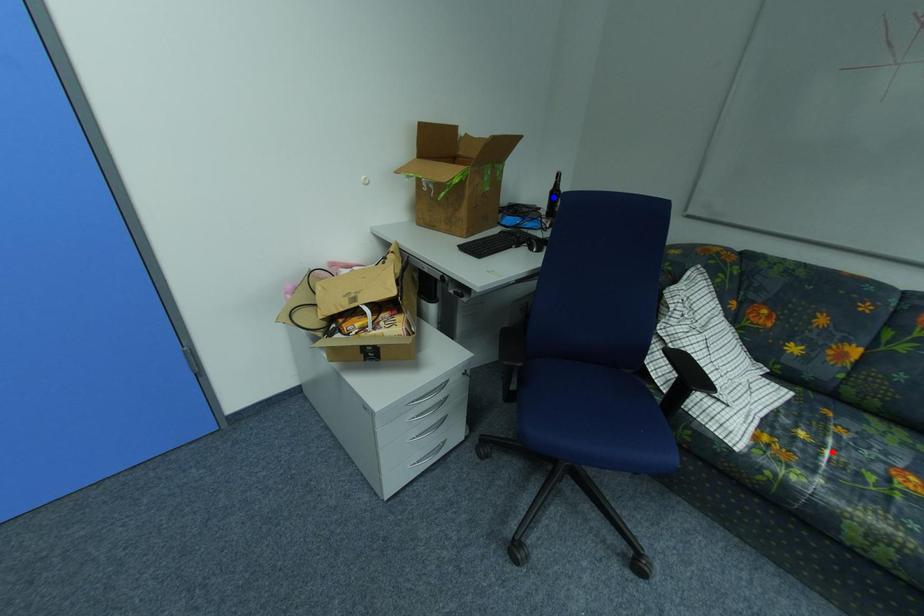
Question: In the image, two points are highlighted. Which point is nearer to the camera? Reply with the corresponding letter.

Choices:
 (A) blue point
 (B) red point

Answer: (B)